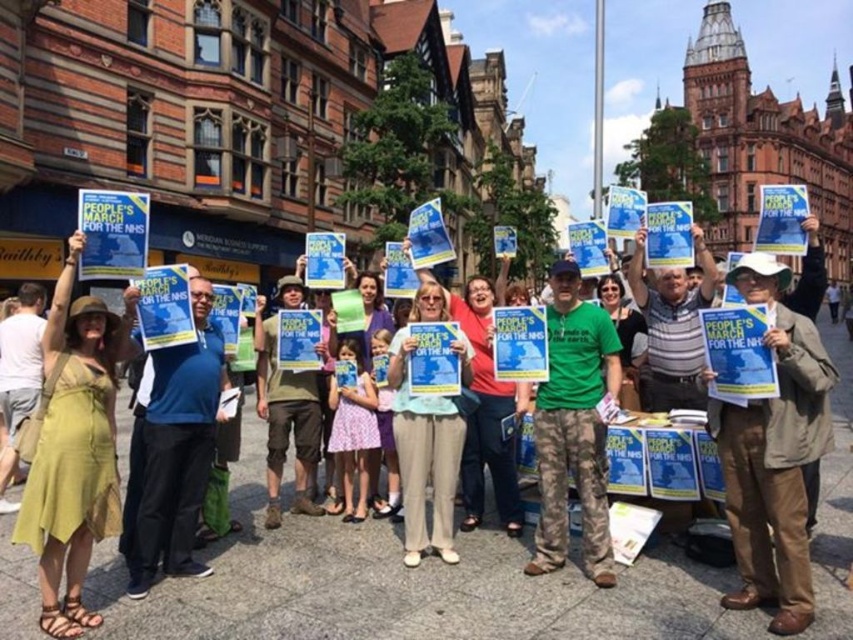
Question: Which object is positioned closest to the matte blue poster at center?

Choices:
 (A) light beige pants at center
 (B) green fabric dress at lower left
 (C) brown leather jacket at center
 (D) green matte t-shirt at center

Answer: (D)

Question: Considering the real-world distances, which object is farthest from the green matte t-shirt at center?

Choices:
 (A) matte blue poster at center
 (B) green fabric dress at lower left

Answer: (B)

Question: Does blue fabric shirt at center have a larger size compared to light beige pants at center?

Choices:
 (A) yes
 (B) no

Answer: (B)

Question: Is green matte t-shirt at center to the right of light beige pants at center from the viewer's perspective?

Choices:
 (A) yes
 (B) no

Answer: (A)

Question: Is the position of green matte t-shirt at center more distant than that of camouflage pants at center?

Choices:
 (A) no
 (B) yes

Answer: (A)

Question: Among these points, which one is farthest from the camera?

Choices:
 (A) (50, 480)
 (B) (576, 358)

Answer: (B)